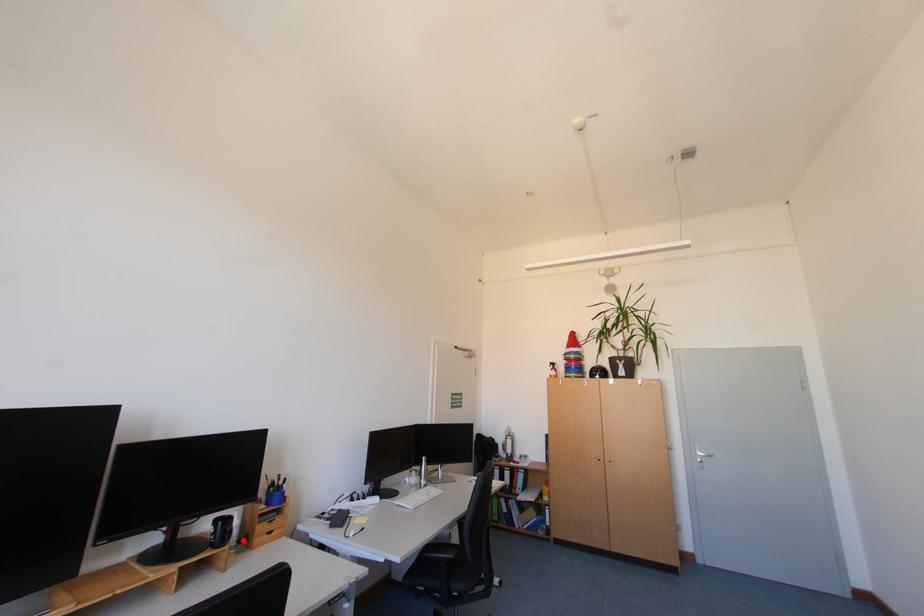
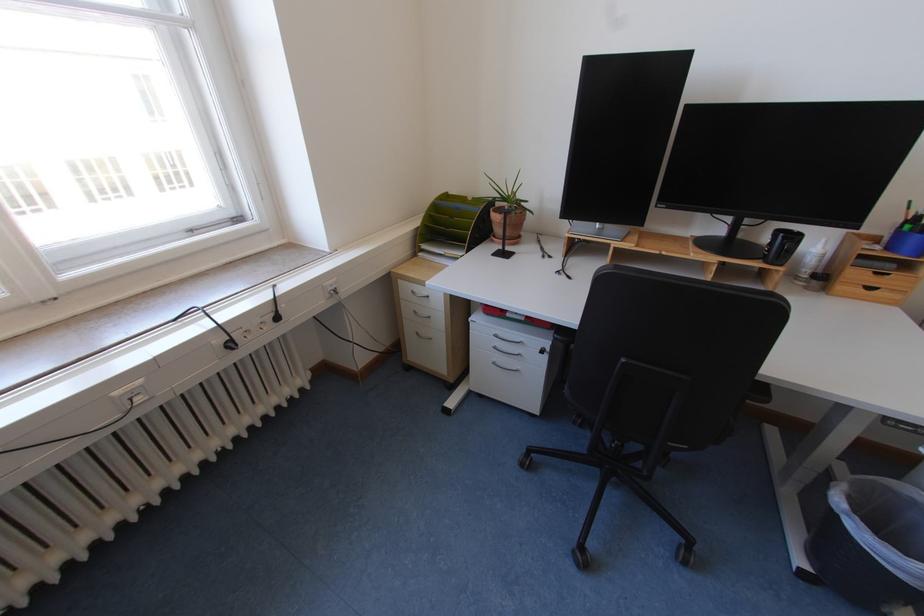
In the second image, find the point that corresponds to the highlighted location in the first image.

(818, 273)